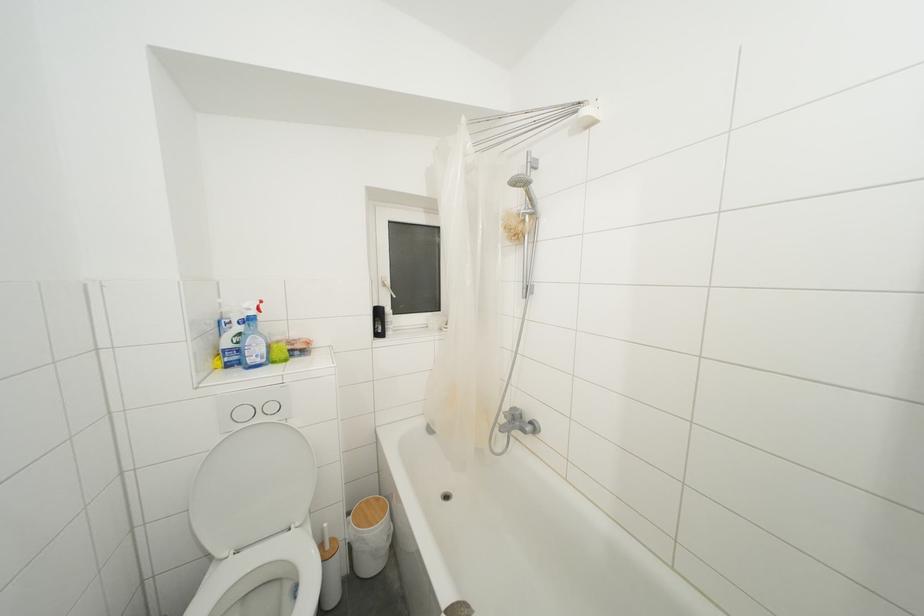
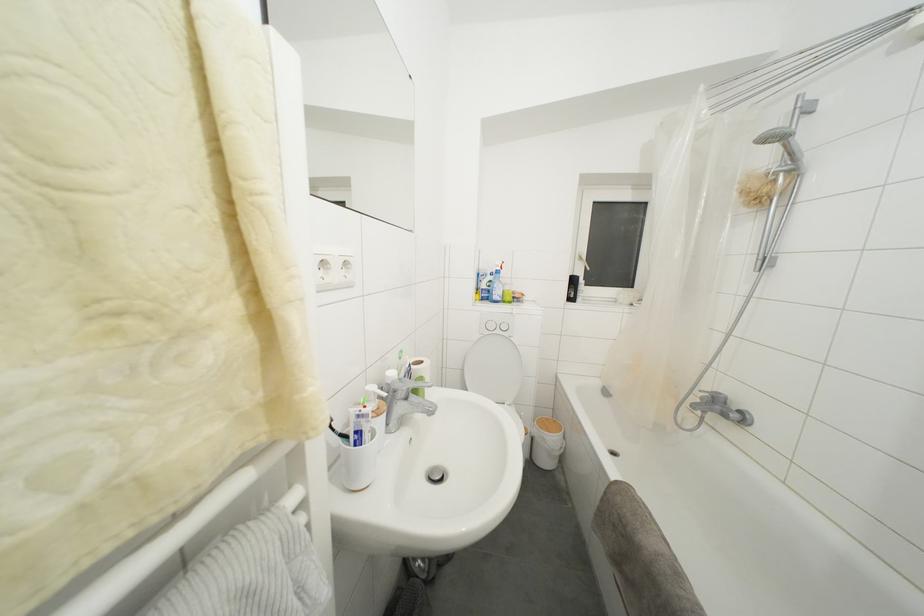
Locate, in the second image, the point that corresponds to (x=383, y=318) in the first image.

(578, 286)